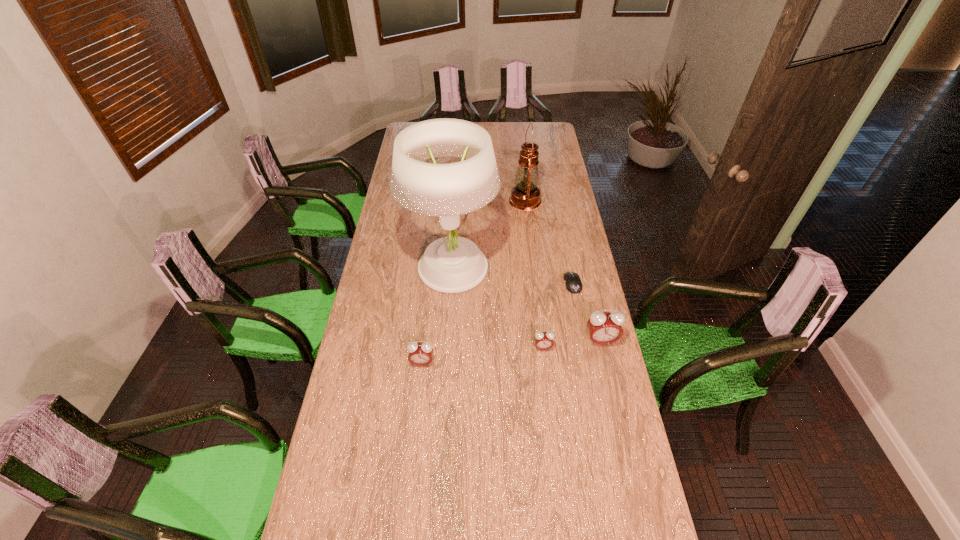
Identify the location of vacant area between the tallest alarm clock and the farthest object. (563, 271).

Identify which object is the nearest to the fifth shortest object. Please provide its 2D coordinates. Your answer should be formatted as a tuple, i.e. [(x, y)], where the tuple contains the x and y coordinates of a point satisfying the conditions above.

[(452, 264)]

Choose which object is the fifth nearest neighbor to the nearest object. Please provide its 2D coordinates. Your answer should be formatted as a tuple, i.e. [(x, y)], where the tuple contains the x and y coordinates of a point satisfying the conditions above.

[(525, 195)]

Identify which alarm clock is the second nearest to the fourth shortest object. Please provide its 2D coordinates. Your answer should be formatted as a tuple, i.e. [(x, y)], where the tuple contains the x and y coordinates of a point satisfying the conditions above.

[(420, 354)]

The height and width of the screenshot is (540, 960). I want to click on the second closest alarm clock relative to the fourth shortest object, so click(420, 354).